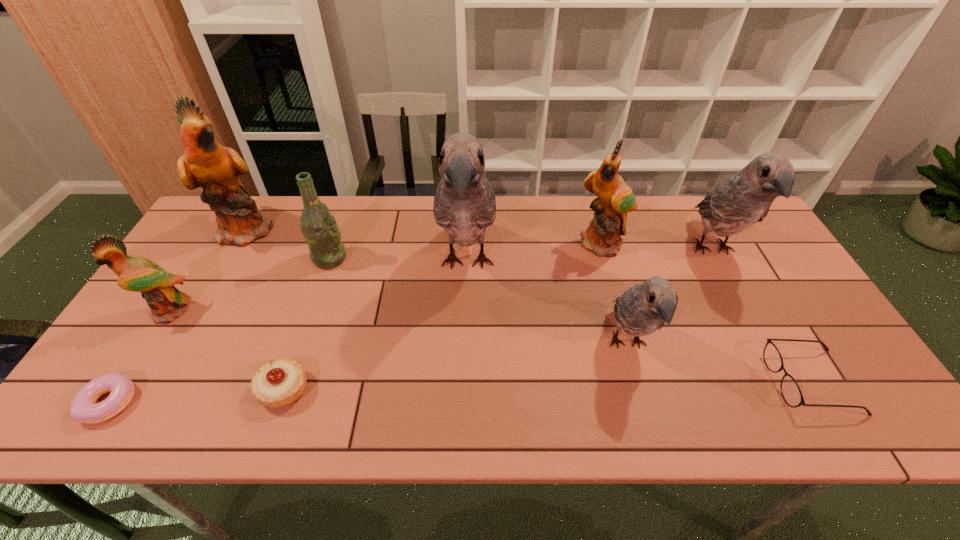
At what (x,y) coordinates should I click in order to perform the action: click on the biggest green parrot. Please return your answer as a coordinate pair (x, y). Looking at the image, I should click on (205, 163).

Locate an element on the screen. The image size is (960, 540). the leftmost gray parrot is located at coordinates (464, 204).

At what (x,y) coordinates should I click in order to perform the action: click on the biggest gray parrot. Please return your answer as a coordinate pair (x, y). The image size is (960, 540). Looking at the image, I should click on (464, 204).

Find the location of `the second biggest green parrot`. the second biggest green parrot is located at coordinates (614, 199).

At what (x,y) coordinates should I click in order to perform the action: click on the rightmost parrot. Please return your answer as a coordinate pair (x, y). Looking at the image, I should click on (741, 200).

I want to click on the rightmost gray parrot, so click(x=741, y=200).

Locate an element on the screen. green beer bottle is located at coordinates (320, 230).

Identify the location of the nearest green parrot. This screenshot has width=960, height=540. (135, 273).

Image resolution: width=960 pixels, height=540 pixels. In order to click on the second gray parrot from left to right in this screenshot , I will do `click(643, 308)`.

The image size is (960, 540). I want to click on the third shortest object, so click(279, 383).